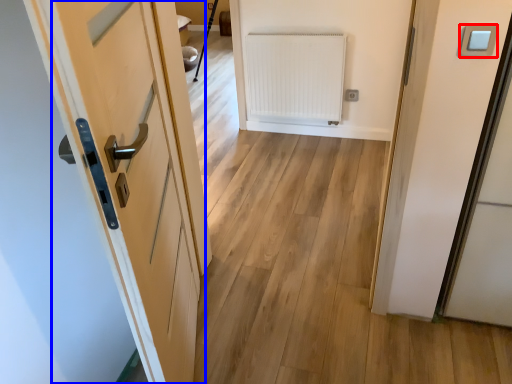
Question: Which of the following is the closest to the observer, light switch (highlighted by a red box) or door (highlighted by a blue box)?

Choices:
 (A) light switch
 (B) door

Answer: (B)